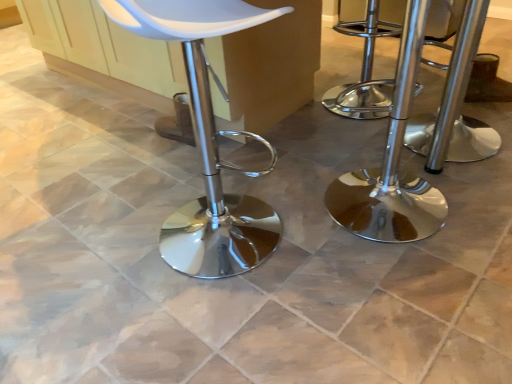
Identify the location of vacant area that lies between white matte stool at center and polished chrome stool at center, the first stool when ordered from right to left. (344, 173).